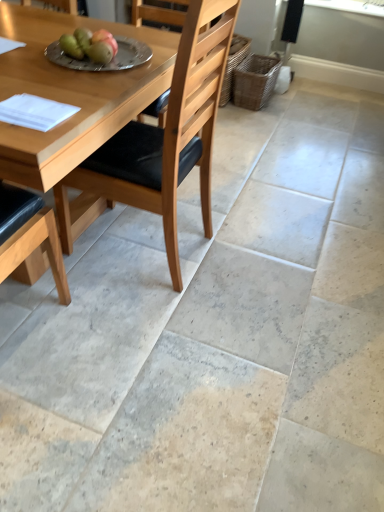
Locate an element on the screen. The width and height of the screenshot is (384, 512). vacant point to the right of woven brown basket at right is located at coordinates (293, 108).